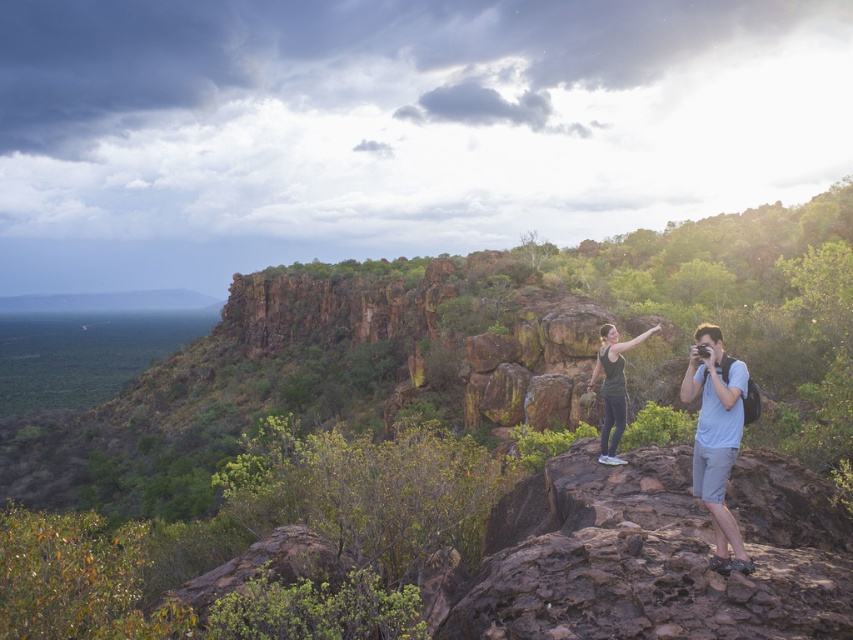
Is rustic rock formation at center below light blue fabric camera at right?

Actually, rustic rock formation at center is above light blue fabric camera at right.

Looking at this image, measure the distance between rustic rock formation at center and light blue fabric camera at right.

rustic rock formation at center is 139.56 meters from light blue fabric camera at right.

Where is `rustic rock formation at center`? Image resolution: width=853 pixels, height=640 pixels. rustic rock formation at center is located at coordinates (419, 470).

Does point (349, 321) come behind point (732, 454)?

Yes, point (349, 321) is behind point (732, 454).

Does rustic rock formation at center lie in front of matte black tank top at center?

That is True.

I want to click on rustic rock formation at center, so click(x=419, y=470).

Does light blue fabric camera at right have a greater width compared to black matte tank top at center?

In fact, light blue fabric camera at right might be narrower than black matte tank top at center.

Does light blue fabric camera at right come behind black matte tank top at center?

No, it is not.

What do you see at coordinates (717, 436) in the screenshot? The height and width of the screenshot is (640, 853). I see `light blue fabric camera at right` at bounding box center [717, 436].

You are a GUI agent. You are given a task and a screenshot of the screen. Output one action in this format:
    pyautogui.click(x=<x>, y=<y>)
    Task: Click on the light blue fabric camera at right
    The height and width of the screenshot is (640, 853).
    Given the screenshot: What is the action you would take?
    pyautogui.click(x=717, y=436)